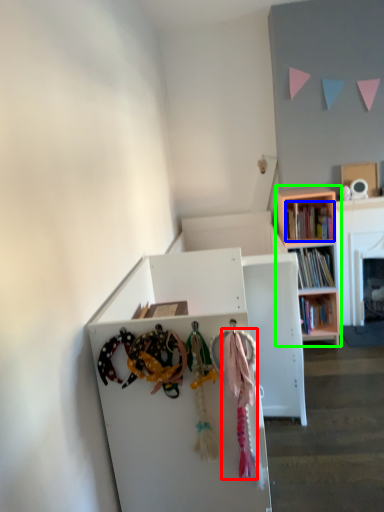
Question: Which is nearer to the clothesline (highlighted by a red box)? book (highlighted by a blue box) or bookcase (highlighted by a green box).

Choices:
 (A) book
 (B) bookcase

Answer: (A)